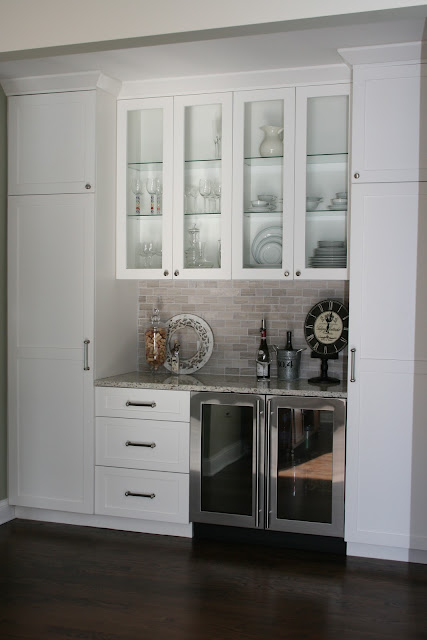
At what (x,y) coordinates should I click in order to perform the action: click on plates. Please return your answer as a coordinate pair (x, y). This screenshot has width=427, height=640. Looking at the image, I should click on (262, 253).